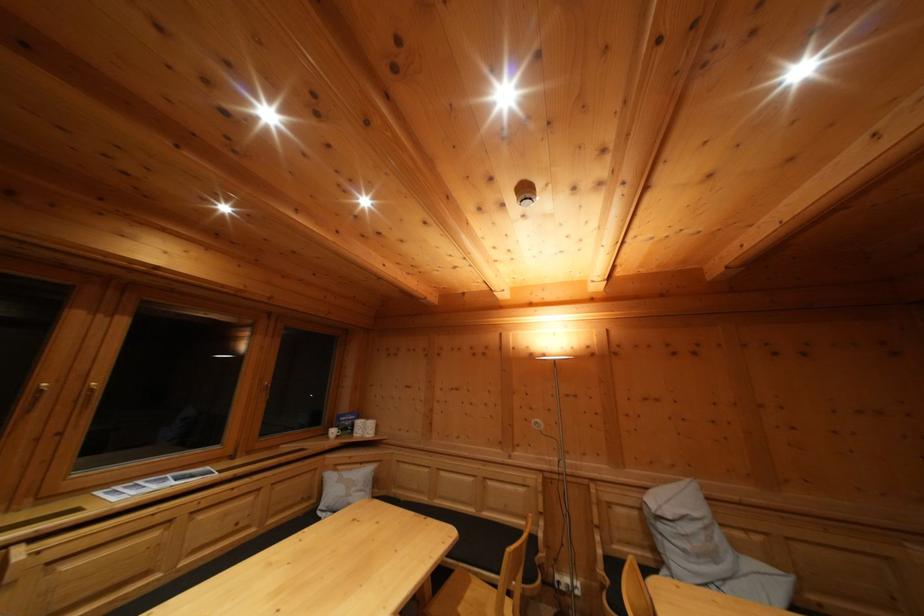
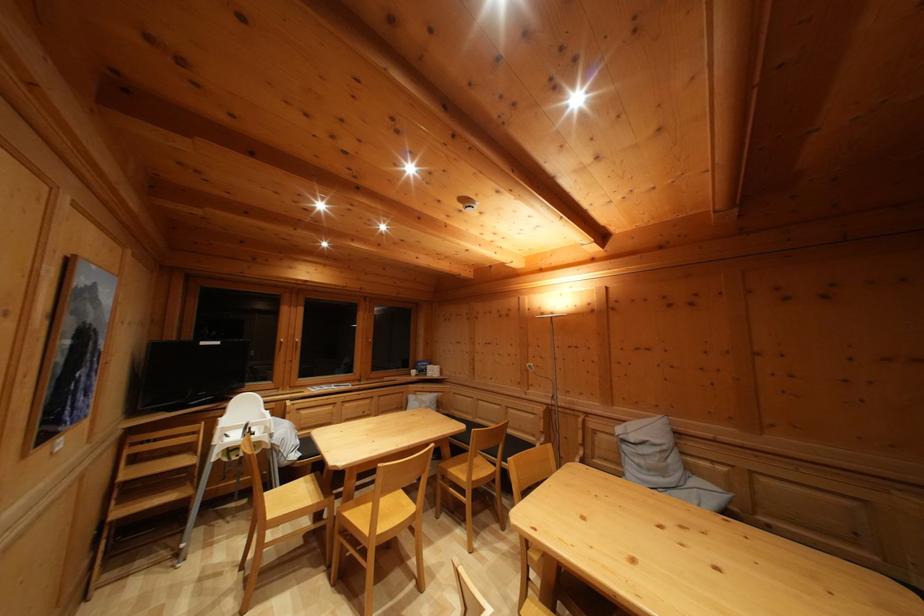
In the second image, find the point that corresponds to (x=666, y=533) in the first image.

(629, 454)